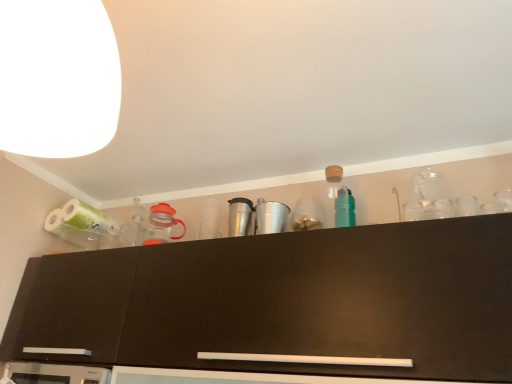
Question: Is white matte lampshade at upper left positioned behind matte black cabinet at upper center?

Choices:
 (A) yes
 (B) no

Answer: (B)

Question: Is white matte lampshade at upper left at the right side of matte black cabinet at upper center?

Choices:
 (A) no
 (B) yes

Answer: (A)

Question: From a real-world perspective, does white matte lampshade at upper left sit lower than matte black cabinet at upper center?

Choices:
 (A) yes
 (B) no

Answer: (B)

Question: From the image's perspective, is white matte lampshade at upper left located above matte black cabinet at upper center?

Choices:
 (A) yes
 (B) no

Answer: (A)

Question: Can you confirm if white matte lampshade at upper left is wider than matte black cabinet at upper center?

Choices:
 (A) yes
 (B) no

Answer: (B)

Question: Is the surface of white matte lampshade at upper left in direct contact with matte black cabinet at upper center?

Choices:
 (A) no
 (B) yes

Answer: (A)

Question: From a real-world perspective, is matte black cabinet at upper center beneath white matte lampshade at upper left?

Choices:
 (A) no
 (B) yes

Answer: (B)

Question: From the image's perspective, is matte black cabinet at upper center located beneath white matte lampshade at upper left?

Choices:
 (A) yes
 (B) no

Answer: (A)

Question: Would you say matte black cabinet at upper center is outside white matte lampshade at upper left?

Choices:
 (A) no
 (B) yes

Answer: (B)

Question: From the image's perspective, is matte black cabinet at upper center over white matte lampshade at upper left?

Choices:
 (A) no
 (B) yes

Answer: (A)

Question: Is matte black cabinet at upper center behind white matte lampshade at upper left?

Choices:
 (A) yes
 (B) no

Answer: (A)

Question: Is matte black cabinet at upper center at the left side of white matte lampshade at upper left?

Choices:
 (A) no
 (B) yes

Answer: (A)

Question: In terms of size, does white matte lampshade at upper left appear bigger or smaller than matte black cabinet at upper center?

Choices:
 (A) small
 (B) big

Answer: (A)